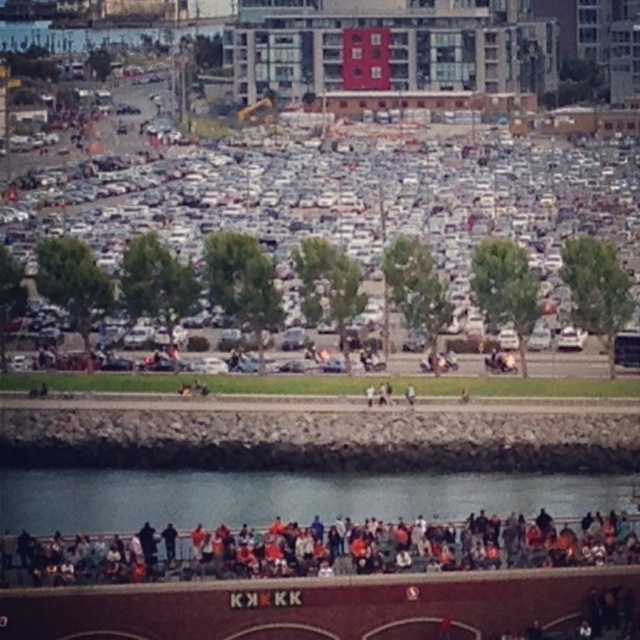
Question: Is clear water at lower center below orange fabric crowd at lower center?

Choices:
 (A) no
 (B) yes

Answer: (B)

Question: Can you confirm if clear water at lower center is wider than orange fabric crowd at lower center?

Choices:
 (A) yes
 (B) no

Answer: (A)

Question: Among these points, which one is farthest from the camera?

Choices:
 (A) coord(20,586)
 (B) coord(10,477)

Answer: (B)

Question: Among these points, which one is nearest to the camera?

Choices:
 (A) (356, 515)
 (B) (76, 556)

Answer: (B)

Question: Does clear water at lower center have a greater width compared to orange fabric crowd at lower center?

Choices:
 (A) no
 (B) yes

Answer: (B)

Question: Which of the following is the closest to the observer?

Choices:
 (A) (595, 532)
 (B) (568, 484)

Answer: (A)